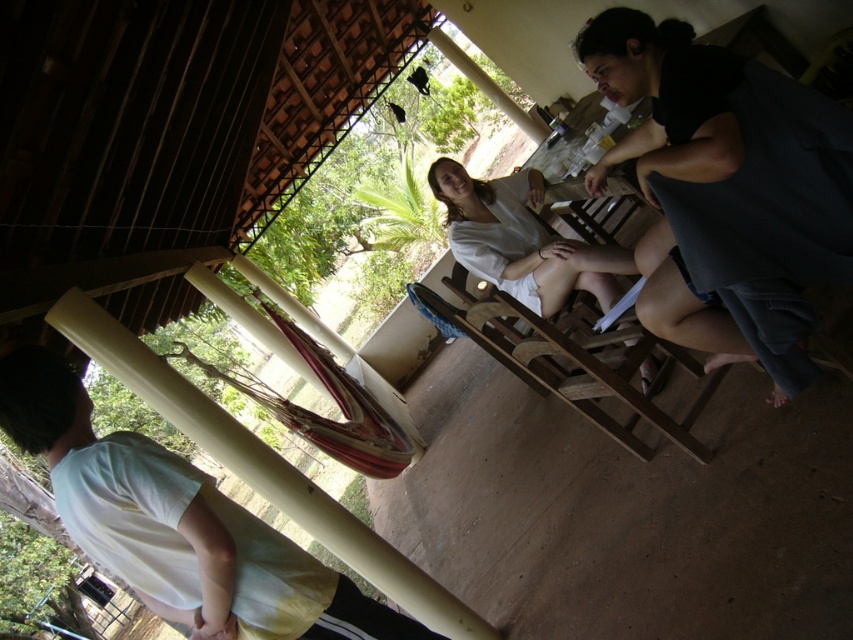
You are standing at the point labeled point (730, 108) and want to walk to the point labeled point (492, 205). Which direction should you move in to get closer to your destination?

You should move away from the camera since point (730, 108) is closer to the camera than point (492, 205).

You are a photographer trying to capture a clear shot of the black cotton shorts at right and the white cotton shirt at lower left. Based on their positions, which one is closer to the camera?

The black cotton shorts at right is in front of the white cotton shirt at lower left, so it is closer to the camera.